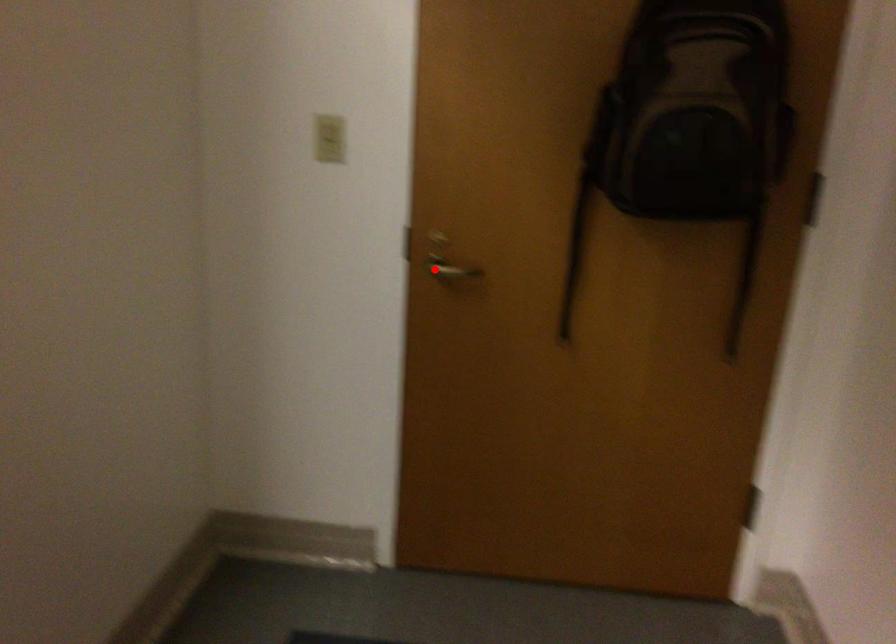
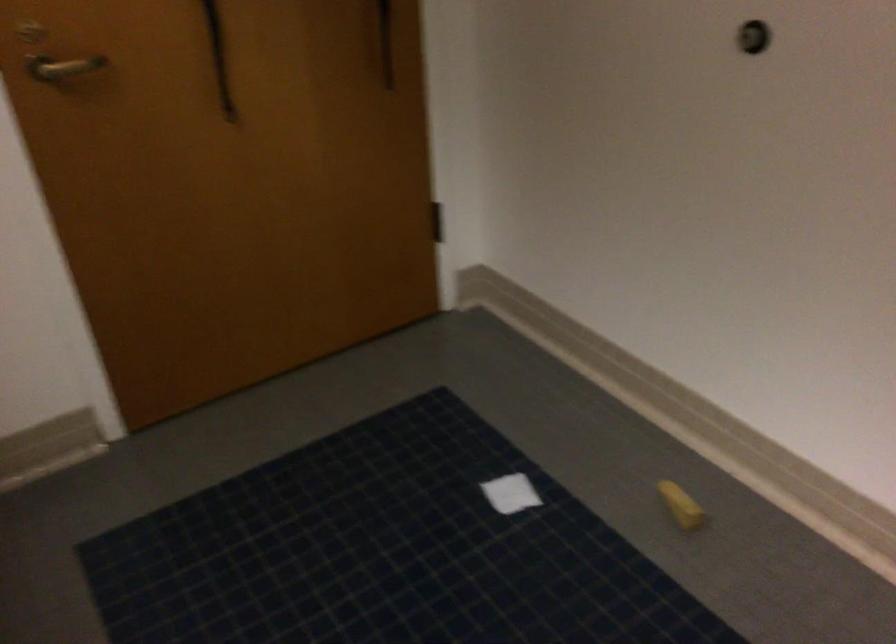
In the second image, find the point that corresponds to the highlighted location in the first image.

(62, 67)